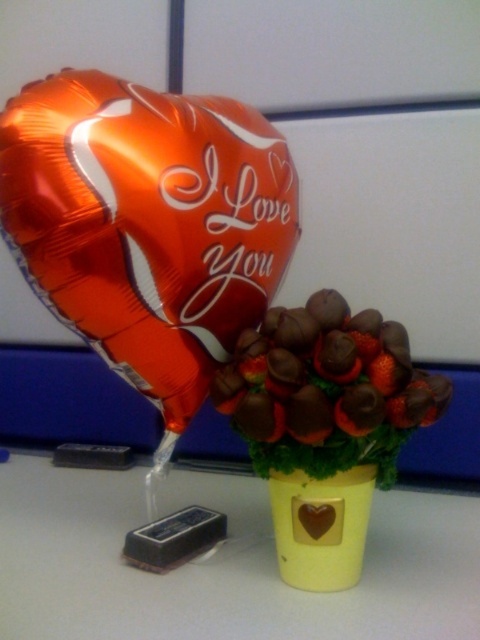
You are a delivery person who needs to place a package that is 60 centimeters long between the shiny metallic heart at upper left and the brushed metal chocolate bar at lower left. Can you fit the package between them without bending it?

The distance between the shiny metallic heart at upper left and the brushed metal chocolate bar at lower left is 60.84 centimeters. Since the package is 60 centimeters long, it can fit between them without bending as the space is slightly larger than the package.